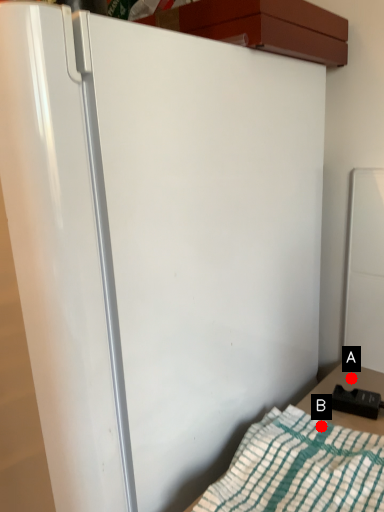
Question: Two points are circled on the image, labeled by A and B beside each circle. Among these points, which one is farthest from the camera?

Choices:
 (A) A is further
 (B) B is further

Answer: (A)